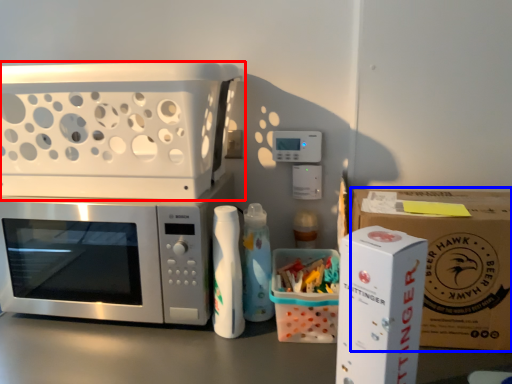
Question: Among these objects, which one is farthest to the camera, appliance (highlighted by a red box) or cardboard box (highlighted by a blue box)?

Choices:
 (A) appliance
 (B) cardboard box

Answer: (A)